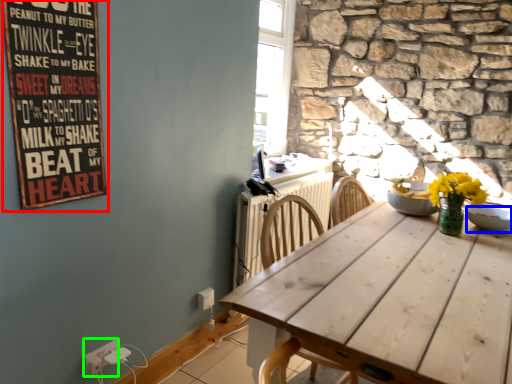
Question: Based on their relative distances, which object is nearer to bulletin board (highlighted by a red box)? Choose from bowl (highlighted by a blue box) and electric outlet (highlighted by a green box).

Choices:
 (A) bowl
 (B) electric outlet

Answer: (B)